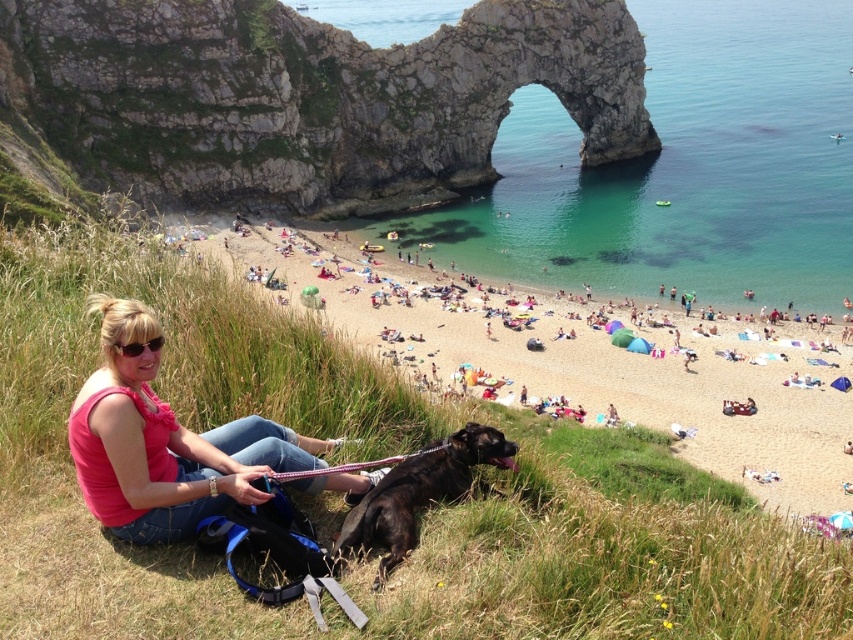
You are a photographer trying to capture the entire scene of the beige sand beach at lower center and the pink fabric at lower left in one shot. Which object should you frame first to ensure both are fully visible in your photo?

You should frame the beige sand beach at lower center first because it is wider than the pink fabric at lower left, so capturing its full width will naturally include the narrower pink fabric at lower left in the frame.

You are a photographer trying to capture the entire scene of the beige sand beach at lower center and the pink fabric at lower left in one shot. Based on their positions, which object should you position closer to the left side of your camera frame?

The pink fabric at lower left should be positioned closer to the left side of your camera frame since the beige sand beach at lower center is located to the right of it.